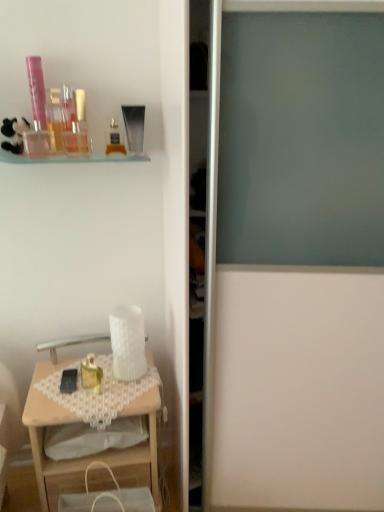
This screenshot has height=512, width=384. I want to click on vacant area situated to the left side of gold metallic perfume at lower left, placed as the first toiletry when sorted from bottom to top, so click(x=53, y=389).